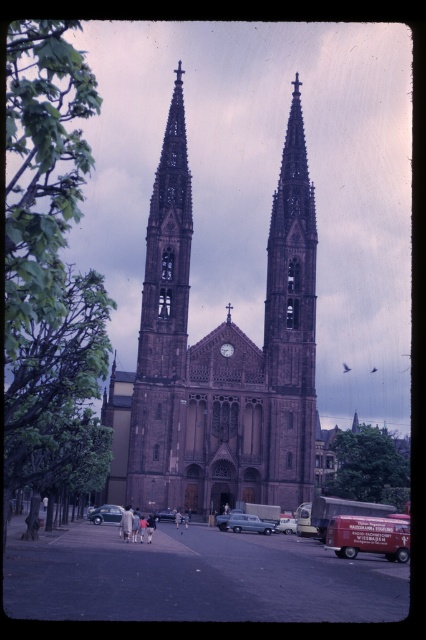
You are standing in front of the brown stone church at center and want to take a photo of the light blue metallic car at center. Since both are in the center, which one should you focus on to ensure the car is in clear view?

The light blue metallic car at center is farther away from the viewer than the brown stone church at center, so you should focus on the car to ensure it is in clear view.

You are a delivery driver who needs to park your vehicle in a space that can only accommodate vehicles up to the width of the shiny silver sedan at center. You have a vehicle that is as wide as the metallic silver van at center. Can you safely park your vehicle in this space?

Result: The metallic silver van at center is wider than the shiny silver sedan at center, so your vehicle cannot safely park in the space designed for the sedan.

You are a pedestrian standing at the entrance of the Gothic church and want to cross the paved area safely. There are two vehicles in front of you, a metallic silver van at center and a shiny silver sedan at center. Which vehicle is closer to the church entrance?

The metallic silver van at center is closer to the church entrance because it is located below the shiny silver sedan at center, indicating it is positioned lower on the paved area nearer to the entrance.